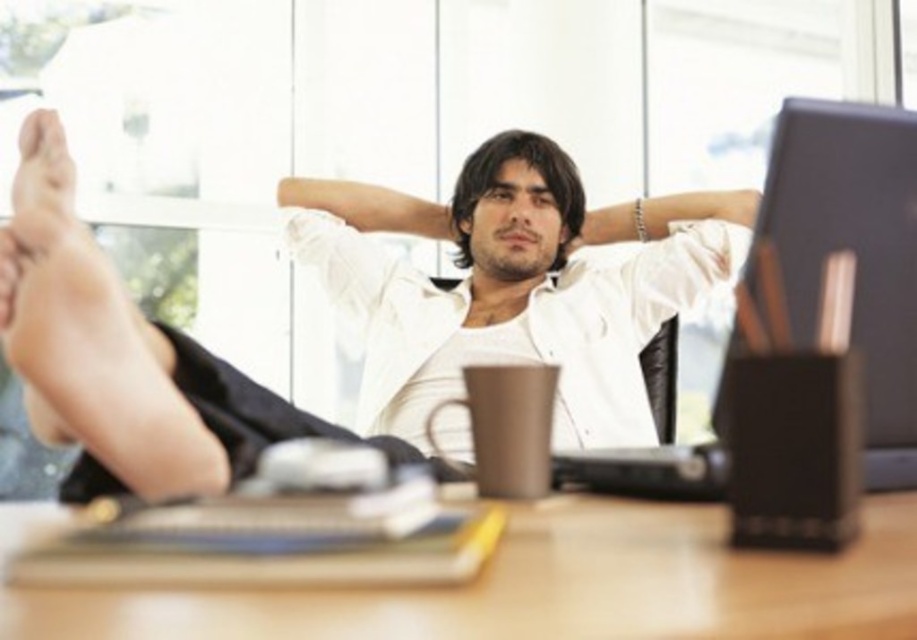
Question: Which of the following is the closest to the observer?

Choices:
 (A) (516, 204)
 (B) (786, 337)
 (C) (553, 529)

Answer: (C)

Question: Is white matte shirt at center above matte black monitor at right?

Choices:
 (A) no
 (B) yes

Answer: (B)

Question: Which point is closer to the camera?

Choices:
 (A) wooden table at center
 (B) white matte shirt at center

Answer: (A)

Question: Is wooden table at center wider than matte black monitor at right?

Choices:
 (A) no
 (B) yes

Answer: (B)

Question: Can you confirm if wooden table at center is positioned below matte black monitor at right?

Choices:
 (A) yes
 (B) no

Answer: (A)

Question: Which of these objects is positioned farthest from the matte black monitor at right?

Choices:
 (A) white matte shirt at center
 (B) wooden table at center

Answer: (A)